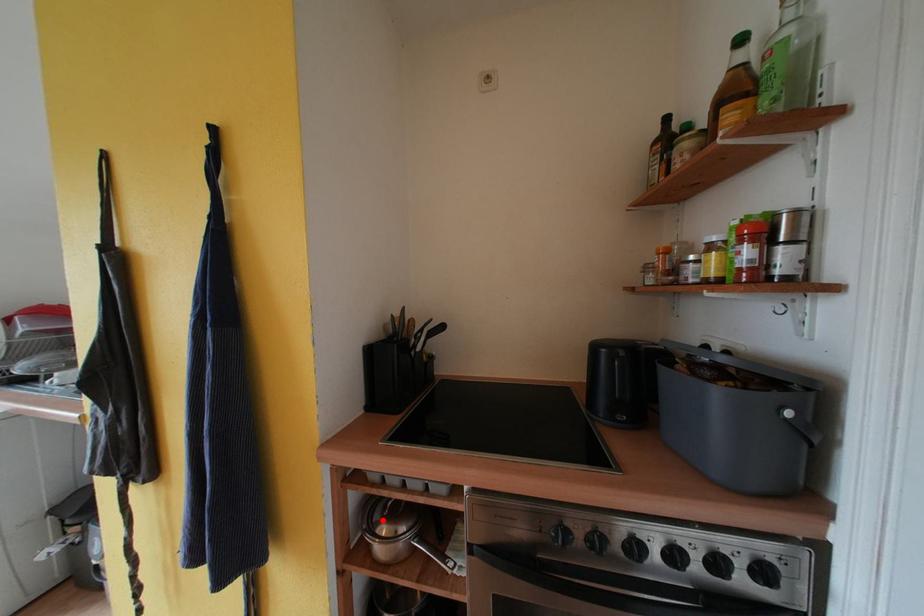
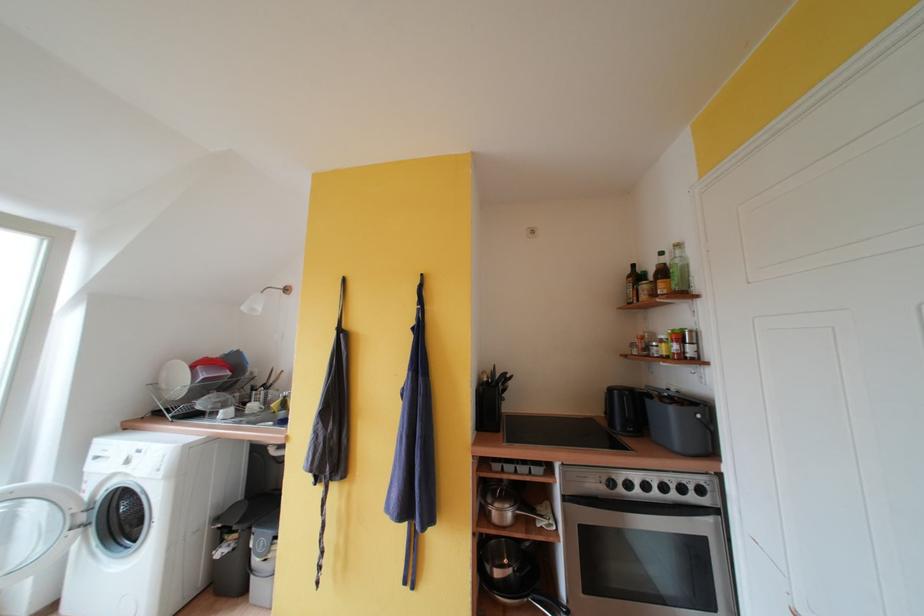
Question: A red point is marked in image1. In image2, is the corresponding 3D point closer to the camera or farther? Reply with the corresponding letter.

Choices:
 (A) The corresponding 3D point is closer.
 (B) The corresponding 3D point is farther.

Answer: (B)